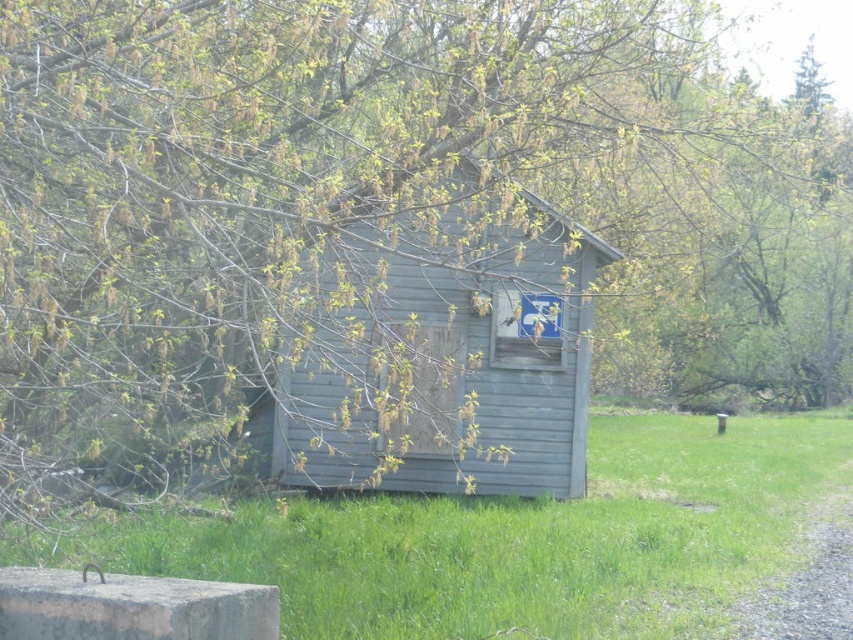
Question: Which of the following is the closest to the observer?

Choices:
 (A) (728, 444)
 (B) (393, 275)

Answer: (B)

Question: Which object is farther from the camera taking this photo?

Choices:
 (A) gray wood hut at center
 (B) green grass at lower center

Answer: (B)

Question: In this image, where is green grass at lower center located relative to gray wood hut at center?

Choices:
 (A) left
 (B) right

Answer: (B)

Question: Can you confirm if green grass at lower center is bigger than gray wood hut at center?

Choices:
 (A) no
 (B) yes

Answer: (B)

Question: Does green grass at lower center appear on the left side of gray wood hut at center?

Choices:
 (A) no
 (B) yes

Answer: (A)